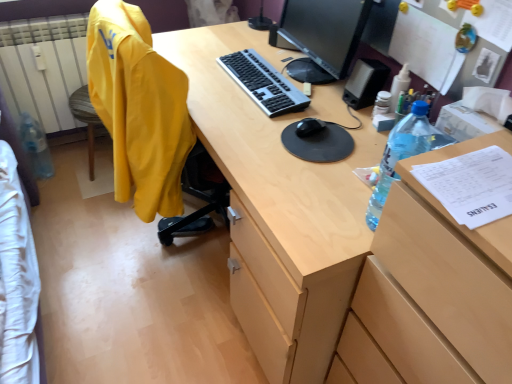
Locate an element on the screen. free space between silver/black plastic keyboard at center and black glossy monitor at upper center is located at coordinates (282, 68).